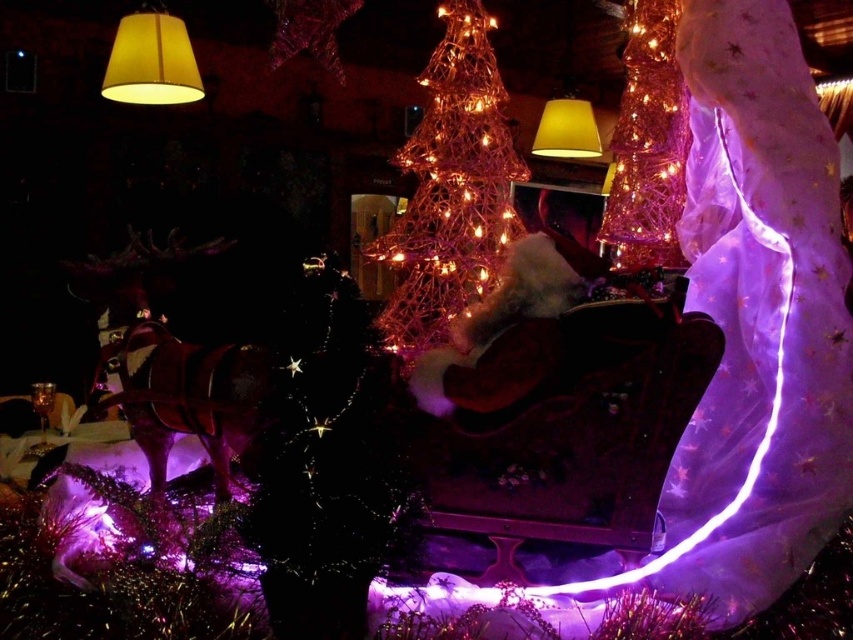
Looking at this image, you are standing in front of a festive holiday display with a miniature horse drawn sleigh. There are two points marked on the display. The first point is at coordinate point (483, 147) and the second is at point (563, 145). If you want to touch the point that is closer to your eyes, which coordinate should you aim for?

You should aim for point (483, 147) because it is closer to the camera than point (563, 145).

You are a guest at the event and want to place a small gift under the iridescent wireframe tree at center. However, there is a yellow fabric lampshade at upper left casting a shadow over part of the tree. Can you estimate how far you need to walk from the lampshade to reach the tree to place the gift?

The iridescent wireframe tree at center is 6.08 feet away from the yellow fabric lampshade at upper left, so you need to walk approximately 6.08 feet from the lampshade to reach the tree.

You are a guest at this event and want to take a photo of both the iridescent wireframe cone at upper right and the yellow fabric lampshade at upper left. Which object should you focus on first to ensure both are in the frame?

You should focus on the iridescent wireframe cone at upper right first because it is closer to you than the yellow fabric lampshade at upper left, ensuring both are in the frame.